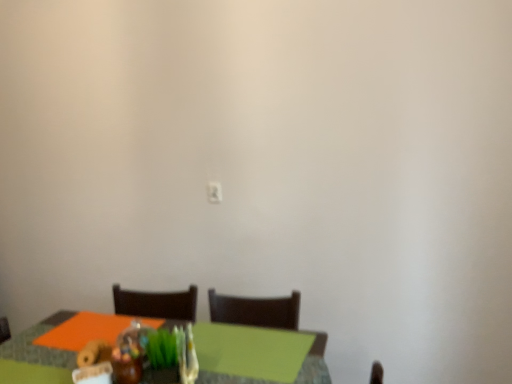
In order to click on vacant space situated above green fabric table at lower center (from a real-world perspective) in this screenshot , I will do `click(168, 323)`.